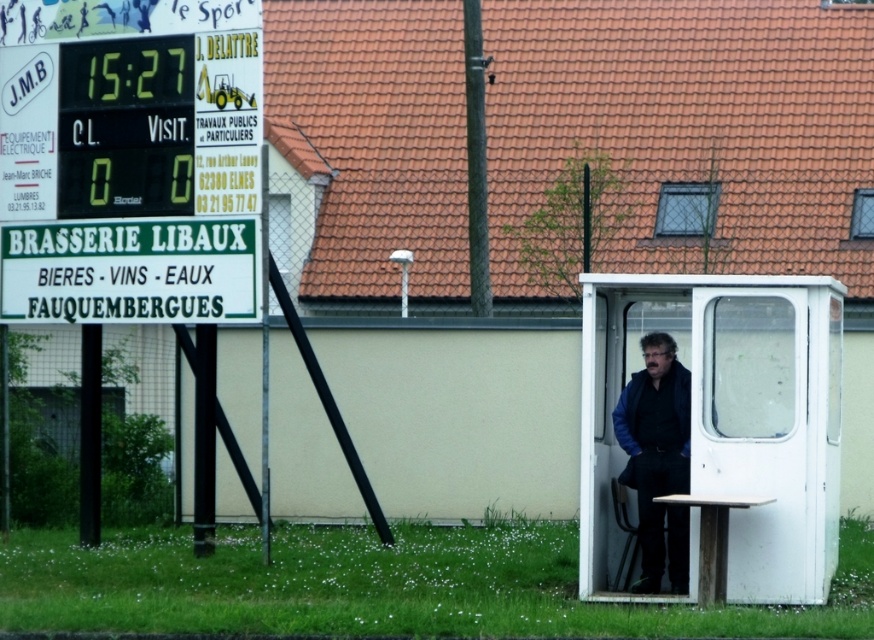
You are standing at the origin point of the soccer field. There is a white plastic booth at center marked by point [725,419]. If you walk straight towards the booth, will you reach it before the goalpost?

The point [725,419] marks the white plastic booth at center, so walking straight towards it would lead you directly to the booth before reaching the goalpost.

You are a photographer standing behind the dark blue jacket at center and want to take a photo of the white plastic booth at center. Can you see the entire booth in your camera frame without moving your position?

The white plastic booth at center has a greater height compared to dark blue jacket at center, so yes, you can see the entire booth in your camera frame since the booth is taller than the jacket, which might be blocking part of the view but since the booth is taller, the top would still be visible.